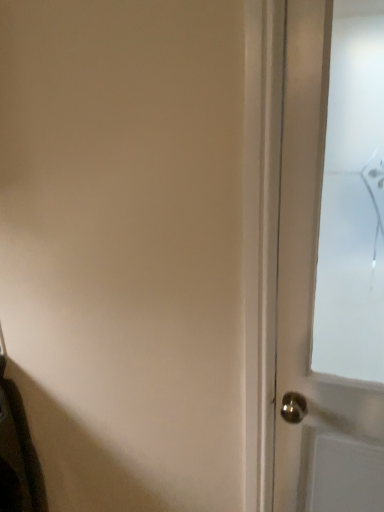
Question: Should I look upward or downward to see satin brass door handle at right?

Choices:
 (A) down
 (B) up

Answer: (A)